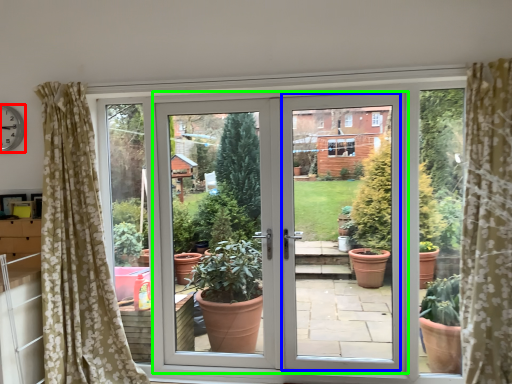
Question: Estimate the real-world distances between objects in this image. Which object is closer to clock (highlighted by a red box), screen door (highlighted by a blue box) or door (highlighted by a green box)?

Choices:
 (A) screen door
 (B) door

Answer: (B)